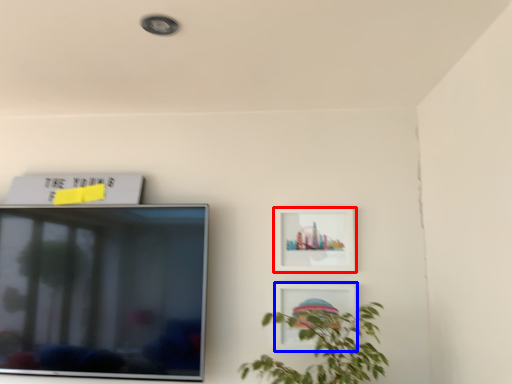
Question: Which of the following is the closest to the observer, picture frame (highlighted by a red box) or picture frame (highlighted by a blue box)?

Choices:
 (A) picture frame
 (B) picture frame

Answer: (B)